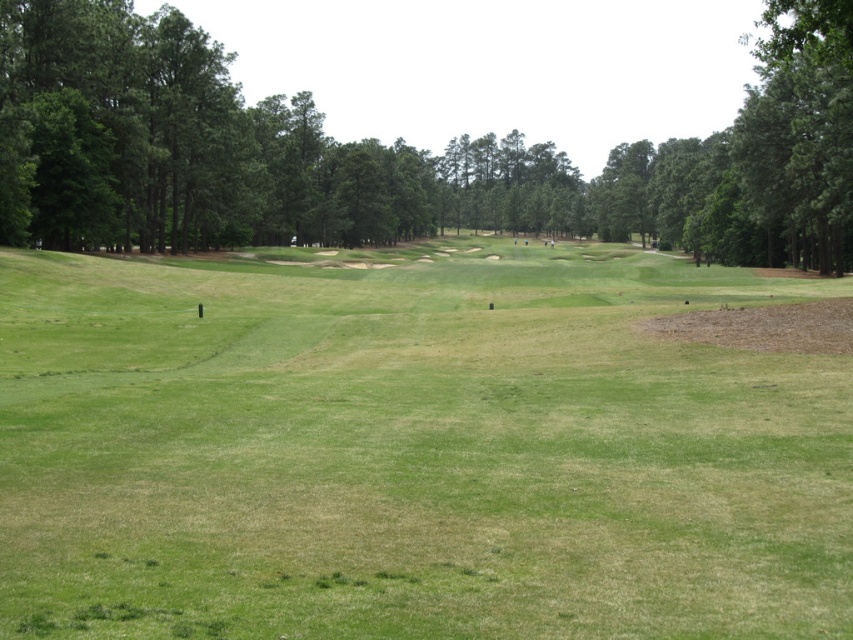
Does green grassy field at center have a smaller size compared to green leafy tree at center?

Correct, green grassy field at center occupies less space than green leafy tree at center.

Which is behind, point (306, 419) or point (672, 141)?

Positioned behind is point (672, 141).

Identify the location of green grassy field at center. This screenshot has width=853, height=640. (412, 451).